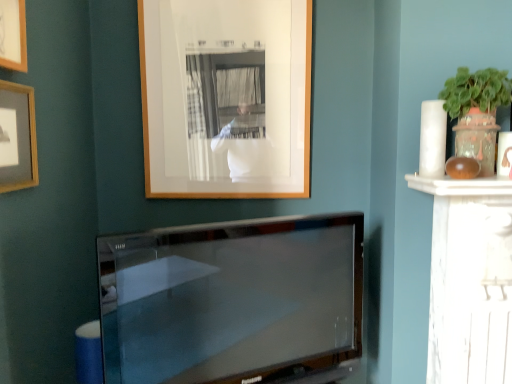
Question: Would you say matte wooden picture frame at upper left, which ranks as the second picture frame in back-to-front order, is to the left or to the right of wooden picture frame at upper left, which appears as the second picture frame when viewed from the left, in the picture?

Choices:
 (A) right
 (B) left

Answer: (B)

Question: In the image, is matte wooden picture frame at upper left, positioned as the 1th picture frame in left-to-right order, positioned in front of or behind wooden picture frame at upper left, the first picture frame in the front-to-back sequence?

Choices:
 (A) behind
 (B) front

Answer: (A)

Question: Which is farther from the wooden picture frame at upper center, which appears as the 3th picture frame when viewed from the left?

Choices:
 (A) matte wooden picture frame at upper left, which is the third picture frame in right-to-left order
 (B) wooden picture frame at upper left, which appears as the second picture frame when viewed from the left
 (C) satin black tv at center

Answer: (B)

Question: Which of these objects is positioned farthest from the wooden picture frame at upper center, which is the first picture frame in back-to-front order?

Choices:
 (A) matte wooden picture frame at upper left, which ranks as the second picture frame in back-to-front order
 (B) satin black tv at center
 (C) wooden picture frame at upper left, which is counted as the 2th picture frame, starting from the right

Answer: (C)